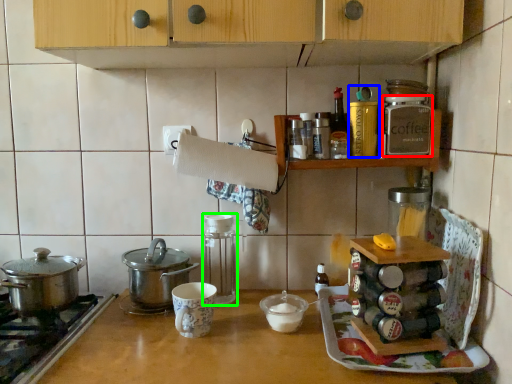
Question: Which object is the farthest from kitchen appliance (highlighted by a red box)? Choose among these: kitchen appliance (highlighted by a blue box) or kitchen appliance (highlighted by a green box).

Choices:
 (A) kitchen appliance
 (B) kitchen appliance

Answer: (B)